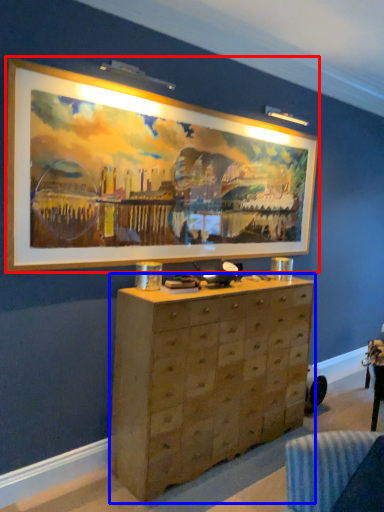
Question: Among these objects, which one is farthest to the camera, picture frame (highlighted by a red box) or chest of drawers (highlighted by a blue box)?

Choices:
 (A) picture frame
 (B) chest of drawers

Answer: (B)